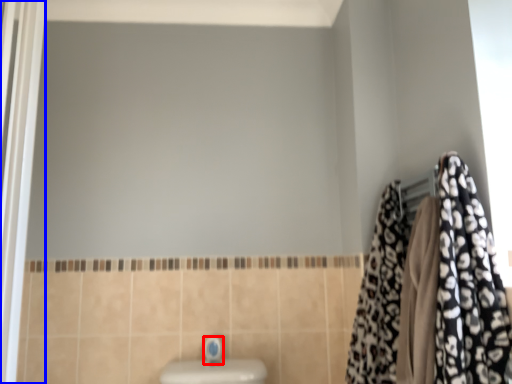
Question: Among these objects, which one is nearest to the camera, faucet (highlighted by a red box) or screen door (highlighted by a blue box)?

Choices:
 (A) faucet
 (B) screen door

Answer: (B)